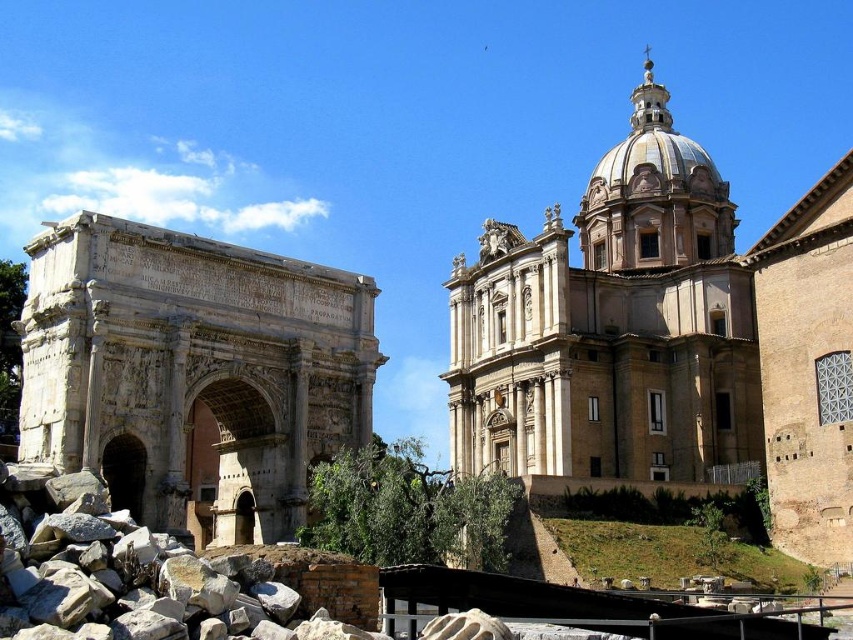
Question: Does beige stone church at upper right appear on the right side of carved stone arch at left?

Choices:
 (A) yes
 (B) no

Answer: (A)

Question: Can you confirm if beige stone church at upper right is positioned above carved stone arch at left?

Choices:
 (A) yes
 (B) no

Answer: (A)

Question: Observing the image, what is the correct spatial positioning of beige stone church at upper right in reference to carved stone arch at left?

Choices:
 (A) right
 (B) left

Answer: (A)

Question: Among these points, which one is nearest to the camera?

Choices:
 (A) pos(231,451)
 (B) pos(842,412)

Answer: (B)